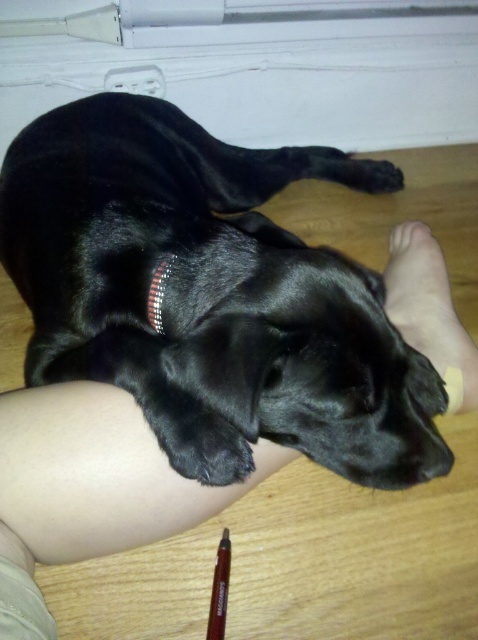
You are a veterinarian examining an image of a dog and a human foot. Based on the scene, can the shiny black dog at lower left and the smooth skin foot at lower right fit side by side on a 1.2 meter wide examination table without overlapping?

The shiny black dog at lower left is wider than the smooth skin foot at lower right. However, since the combined width of both objects is not specified, it is impossible to determine if they can fit side by side on the 1.2 meter wide examination table without overlapping. Additional information about their individual widths is needed to make an accurate assessment.

You are standing in front of the image and want to determine which of the two points, point [172,364] or point [400,244], is closer to you. Based on the scene, which point would you say is nearer?

Point [172,364] is closer to the viewer than point [400,244].

You are a veterinarian examining an image of a dog and a person. The dog has a red collar and is lying on a wooden floor. The person has a bare foot with a yellow bandage on their ankle. You need to determine if the distance between the shiny black dog at lower left and the skinny flesh at lower left is within a safe range for the dog to reach the bandage. The safe range is 12 inches. Is the distance within the safe range?

The shiny black dog at lower left is 13.12 inches from the skinny flesh at lower left. Since the safe range is 12 inches, the distance is slightly beyond the safe range, so the dog cannot comfortably reach the bandage.